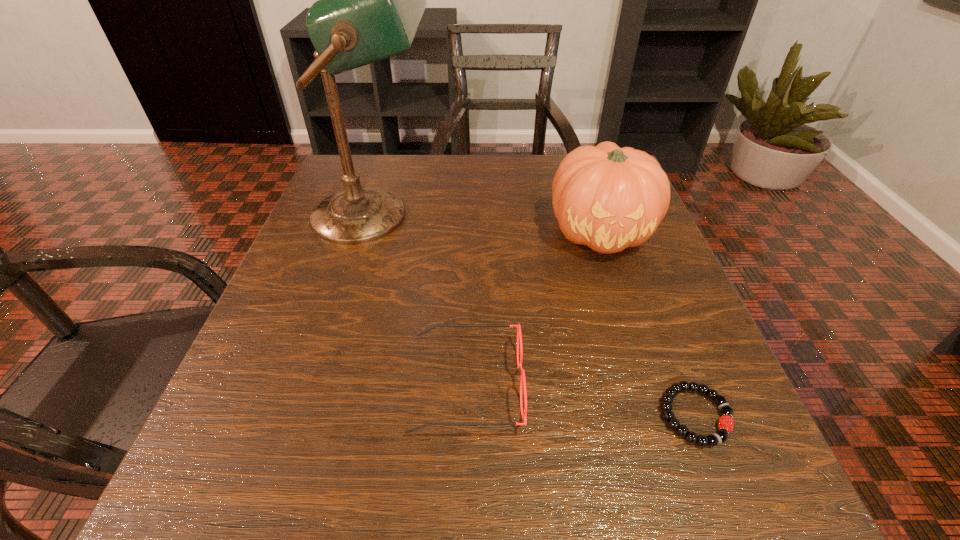
At what (x,y) coordinates should I click in order to perform the action: click on the tallest object. Please return your answer as a coordinate pair (x, y). Looking at the image, I should click on (370, 0).

Find the location of `pumpkin`. pumpkin is located at coordinates (608, 198).

This screenshot has width=960, height=540. Find the location of `spectacles`. spectacles is located at coordinates (522, 378).

At what (x,y) coordinates should I click in order to perform the action: click on the shortest object. Please return your answer as a coordinate pair (x, y). Looking at the image, I should click on (725, 424).

The height and width of the screenshot is (540, 960). What are the coordinates of `vacant position located 0.310m above the green lampshade of the table lamp` in the screenshot? It's located at coord(582,215).

In order to click on free point located 0.060m on the carved face of the pumpkin in this screenshot , I will do `click(621, 292)`.

Where is `blank space located 0.050m on the front-facing side of the third tallest object`? The height and width of the screenshot is (540, 960). blank space located 0.050m on the front-facing side of the third tallest object is located at coordinates (556, 384).

At what (x,y) coordinates should I click in order to perform the action: click on free region located on the left of the bracelet. Please return your answer as a coordinate pair (x, y). Looking at the image, I should click on pos(527,415).

Locate an element on the screen. The image size is (960, 540). table lamp located in the far edge section of the desktop is located at coordinates (370, 0).

This screenshot has width=960, height=540. In order to click on pumpkin located at the far edge in this screenshot , I will do `click(608, 198)`.